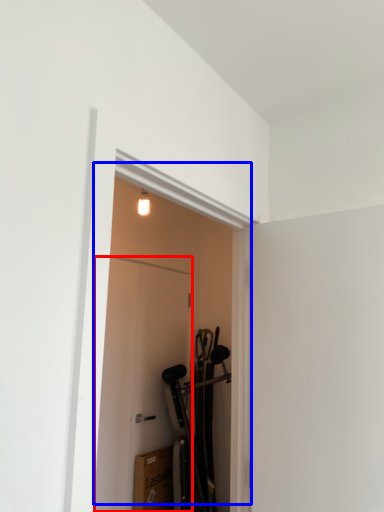
Question: Which of the following is the closest to the observer, door (highlighted by a red box) or door (highlighted by a blue box)?

Choices:
 (A) door
 (B) door

Answer: (B)